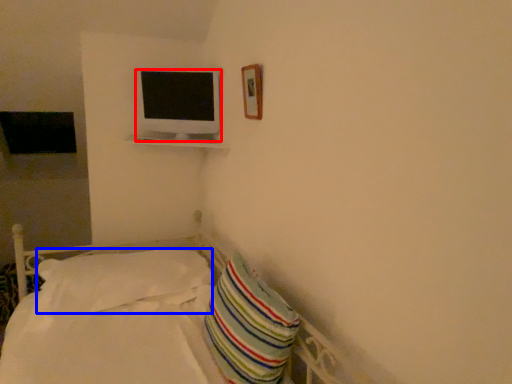
Question: Which object appears farthest to the camera in this image, television (highlighted by a red box) or pillow (highlighted by a blue box)?

Choices:
 (A) television
 (B) pillow

Answer: (A)